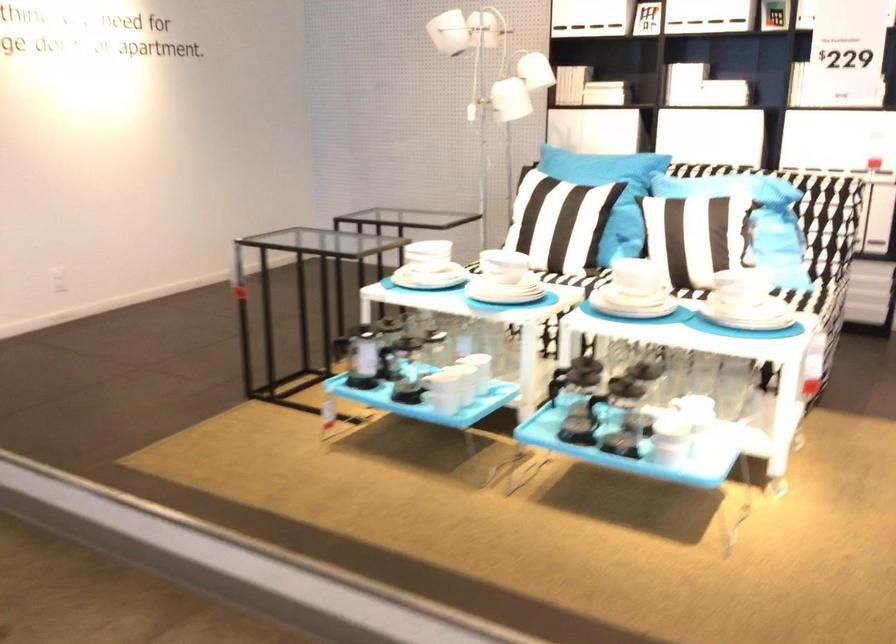
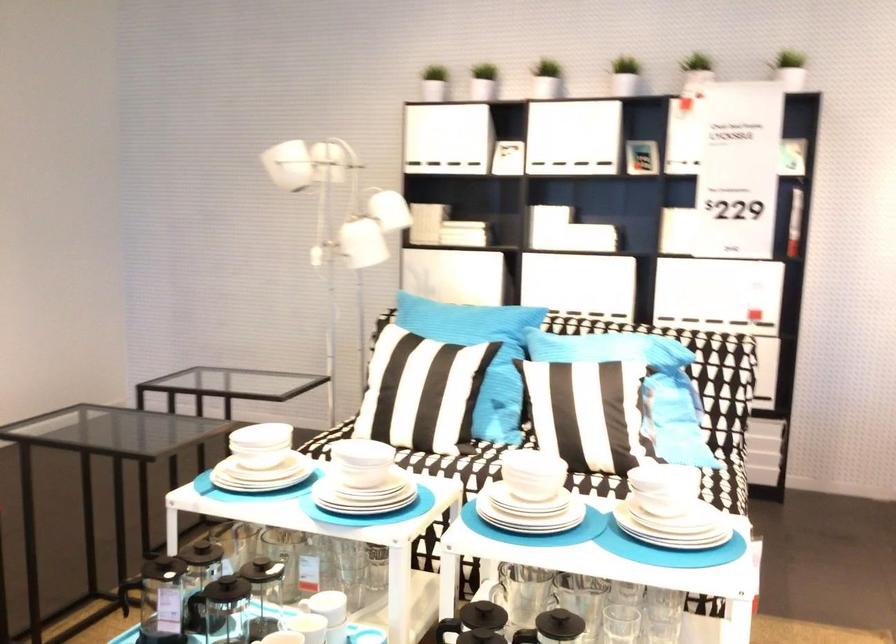
Where in the second image is the point corresponding to (726,252) from the first image?

(619, 442)